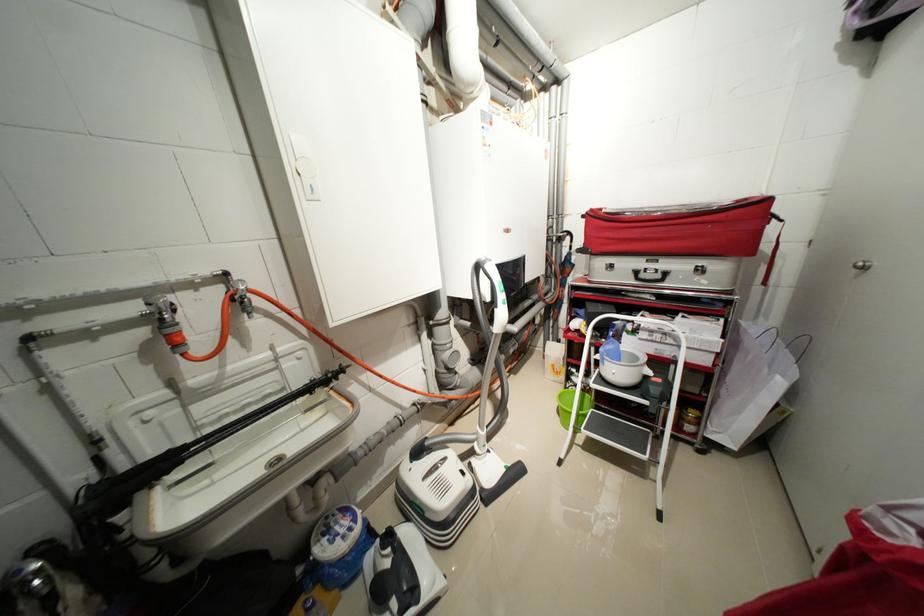
The location [623,367] corresponds to which object?

It refers to a white bowl.